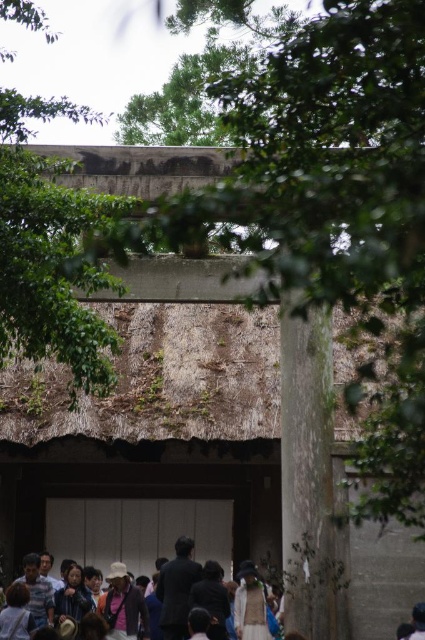
Between smooth gray stone pillar at right and light brown fabric jacket at lower center, which one appears on the right side from the viewer's perspective?

smooth gray stone pillar at right

Is smooth gray stone pillar at right bigger than light brown fabric jacket at lower center?

Yes, smooth gray stone pillar at right is bigger than light brown fabric jacket at lower center.

At what (x,y) coordinates should I click in order to perform the action: click on smooth gray stone pillar at right. Please return your answer as a coordinate pair (x, y). Image resolution: width=425 pixels, height=640 pixels. Looking at the image, I should click on (306, 468).

Is green leafy tree at upper center to the right of light brown fabric jacket at lower center from the viewer's perspective?

Incorrect, green leafy tree at upper center is not on the right side of light brown fabric jacket at lower center.

Who is positioned more to the left, green leafy tree at upper center or light brown fabric jacket at lower center?

Positioned to the left is green leafy tree at upper center.

Which is in front, point (47, 294) or point (214, 632)?

Point (47, 294) is in front.

The width and height of the screenshot is (425, 640). I want to click on green leafy tree at upper center, so click(x=51, y=250).

Does point (104, 340) come behind point (308, 586)?

No, (104, 340) is closer to viewer.

Does point (53, 257) come closer to viewer compared to point (294, 516)?

Yes.

Between point (34, 193) and point (329, 573), which one is positioned behind?

Positioned behind is point (329, 573).

I want to click on green leafy tree at upper center, so click(x=51, y=250).